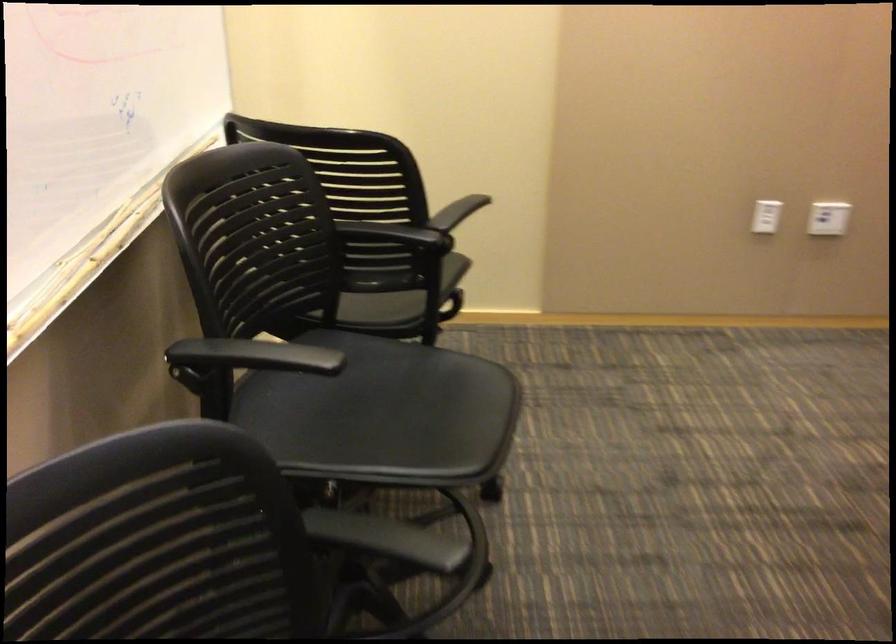
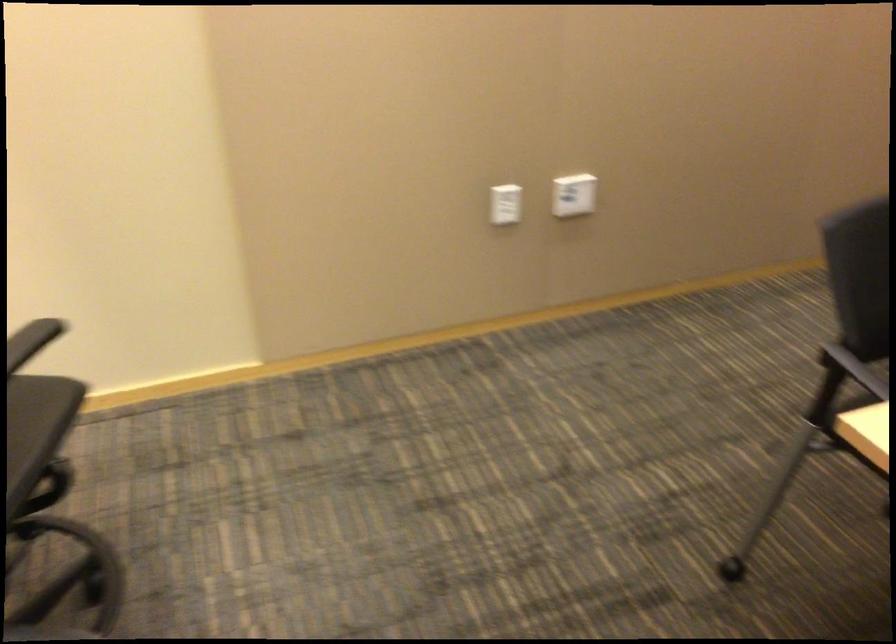
In a continuous first-person perspective shot, in which direction is the camera moving?

The cameraman moved toward right, forward.